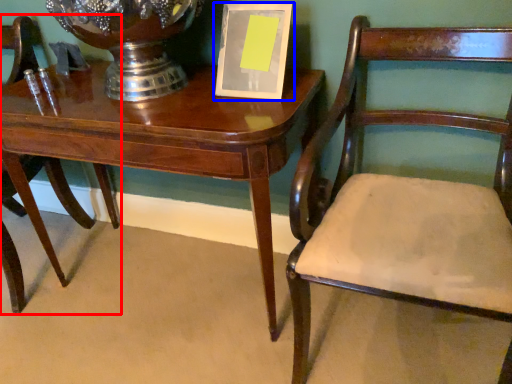
Question: Which object is further to the camera taking this photo, chair (highlighted by a red box) or picture frame (highlighted by a blue box)?

Choices:
 (A) chair
 (B) picture frame

Answer: (A)